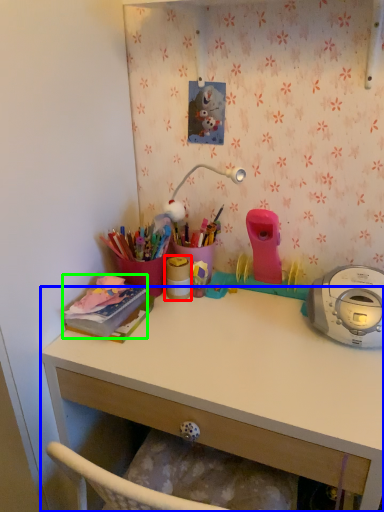
Question: Which object is positioned farthest from office supplies (highlighted by a red box)? Select from desk (highlighted by a blue box) and office supplies (highlighted by a green box).

Choices:
 (A) desk
 (B) office supplies

Answer: (A)